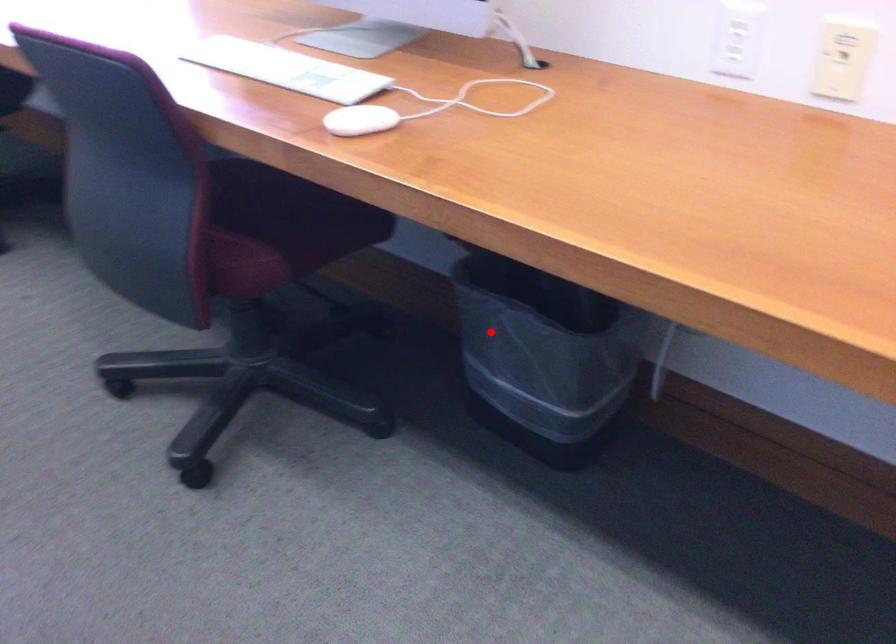
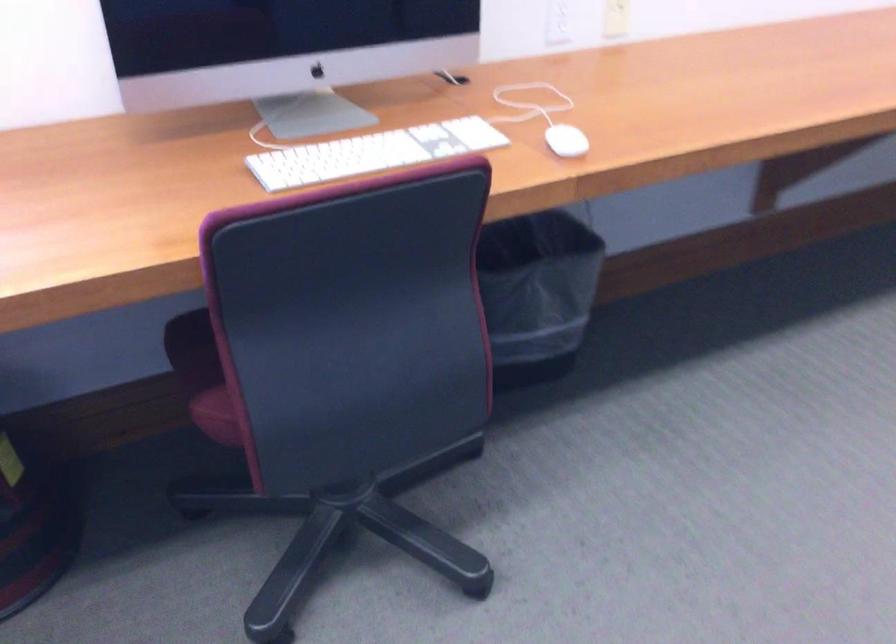
Question: A red point is marked in image1. In image2, is the corresponding 3D point closer to the camera or farther? Reply with the corresponding letter.

Choices:
 (A) The corresponding 3D point is closer.
 (B) The corresponding 3D point is farther.

Answer: (B)